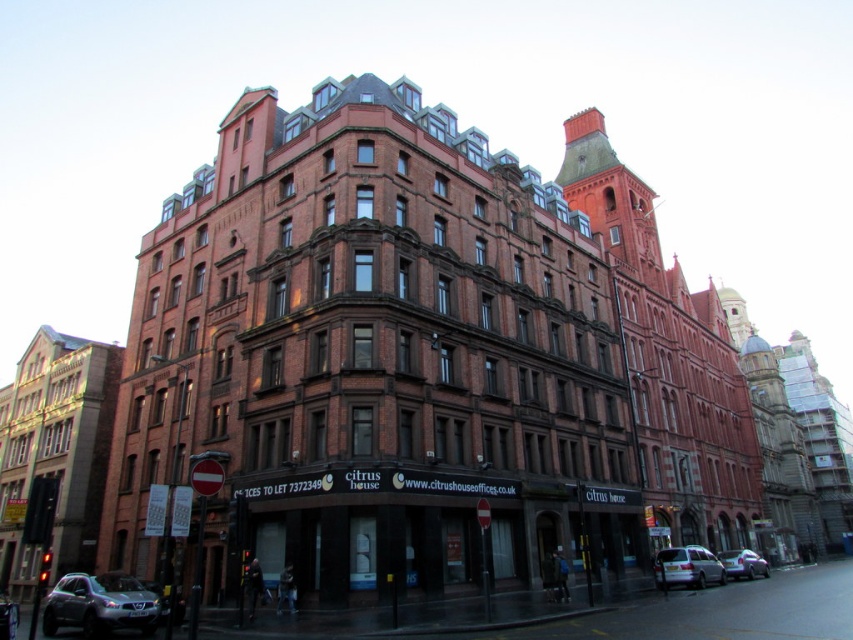
You are standing at the center of the image. Which direction should you look to see the brown brick building at left?

You should look to the left to see the brown brick building at left, as it is positioned at the left side of the image.

You are standing in front of the Victorian building and want to determine the relative positions of two points marked on its facade. Which of the two points, point 1 at coordinates (57, 426) or point 2 at coordinates (701, 556), is closer to you?

Point 1 at coordinates (57, 426) is closer to you because it is further to the viewer than point 2 at coordinates (701, 556).

You are standing at the entrance of the Citrus House building and notice two points marked on the facade. The first point is at coordinate point (561, 536) and the second is at point (13, 604). From your vantage point at the entrance, which point is closer to you?

Point (13, 604) is closer to you because it is in front of point (561, 536).